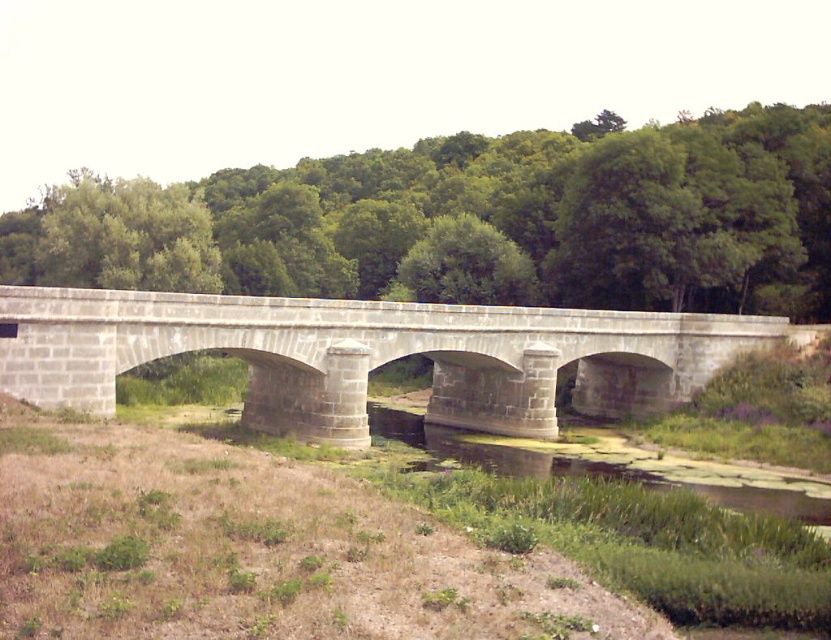
Question: Does green leafy trees at center come in front of gray stone bridge at center?

Choices:
 (A) yes
 (B) no

Answer: (B)

Question: Can you confirm if green leafy trees at center is positioned below gray stone bridge at center?

Choices:
 (A) yes
 (B) no

Answer: (B)

Question: Is green leafy trees at center thinner than gray stone bridge at center?

Choices:
 (A) no
 (B) yes

Answer: (A)

Question: Which point is farther to the camera?

Choices:
 (A) (600, 195)
 (B) (335, 314)

Answer: (A)